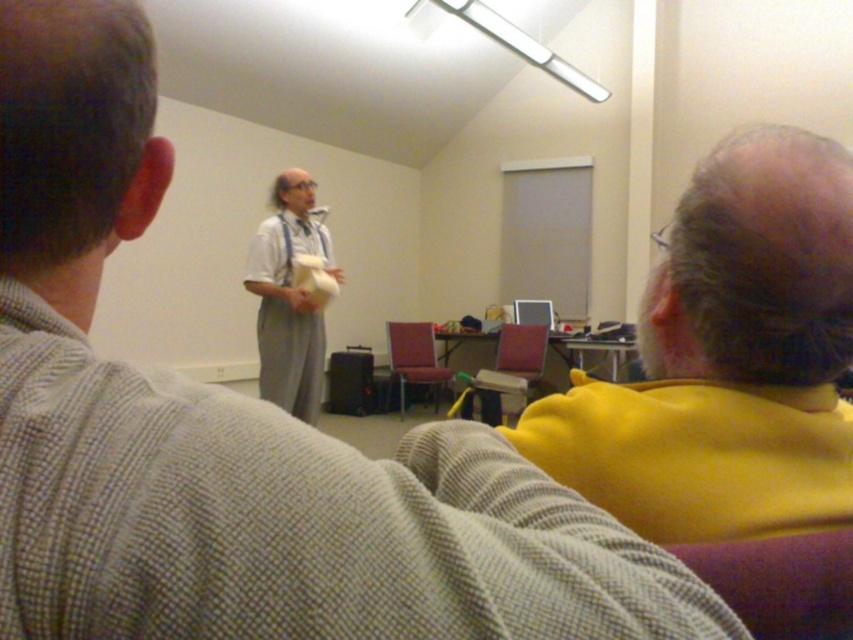
Can you confirm if yellow fabric at upper right is thinner than maroon fabric chair at center?

Correct, yellow fabric at upper right's width is less than maroon fabric chair at center's.

Is yellow fabric at upper right further to the viewer compared to maroon fabric chair at center?

No, it is not.

Where is `yellow fabric at upper right`? yellow fabric at upper right is located at coordinates (727, 358).

Identify the location of yellow fabric at upper right. The width and height of the screenshot is (853, 640). (727, 358).

Between point (604, 500) and point (791, 577), which one is positioned in front?

Positioned in front is point (791, 577).

Can you confirm if yellow fabric at upper right is thinner than velvet purple chair at lower right?

No.

Does point (844, 230) come behind point (779, 625)?

Yes, point (844, 230) is behind point (779, 625).

The width and height of the screenshot is (853, 640). Find the location of `yellow fabric at upper right`. yellow fabric at upper right is located at coordinates (727, 358).

Can you confirm if light gray fabric dress at center is positioned above maroon fabric chair at center?

Indeed, light gray fabric dress at center is positioned over maroon fabric chair at center.

Does light gray fabric dress at center have a larger size compared to maroon fabric chair at center?

Actually, light gray fabric dress at center might be smaller than maroon fabric chair at center.

Which is behind, point (270, 234) or point (396, 380)?

The point (396, 380) is behind.

This screenshot has height=640, width=853. Identify the location of light gray fabric dress at center. (289, 298).